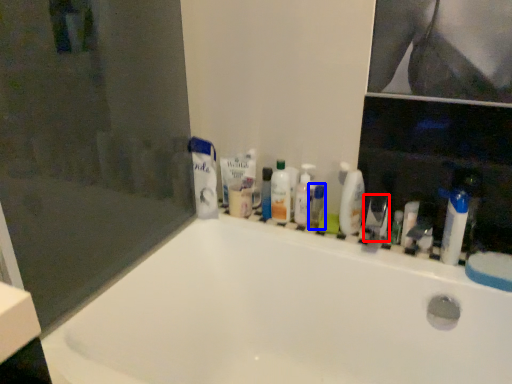
Question: Among these objects, which one is farthest to the camera, toiletry (highlighted by a red box) or mouthwash (highlighted by a blue box)?

Choices:
 (A) toiletry
 (B) mouthwash

Answer: (B)